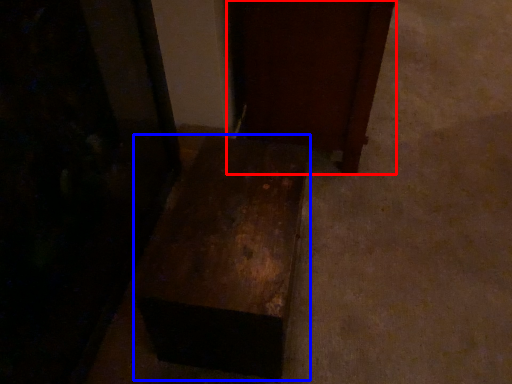
Question: Which of the following is the farthest to the observer, furniture (highlighted by a red box) or furniture (highlighted by a blue box)?

Choices:
 (A) furniture
 (B) furniture

Answer: (A)